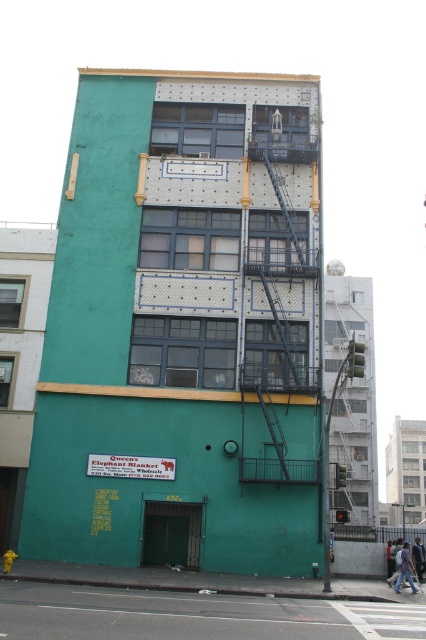
You are standing in front of the teal matte building at center and want to access the black metal fire escape at center. Can you reach the fire escape without going around the building?

The teal matte building at center is in front of the black metal fire escape at center, so you cannot reach the fire escape directly. You will need to go around the building to access it.

You are a window cleaner standing on the ground floor. You need to clean the windows of the teal matte building at center and the black metal fire escape at center. Which one will require you to climb higher?

The teal matte building at center is much taller than the black metal fire escape at center, so you will need to climb higher to clean the teal matte building at center.

You are standing in front of the teal matte building at center and want to reach the black metal fire escape at center. Which direction should you move to get to the fire escape from the building?

The teal matte building at center is positioned on the left side of the black metal fire escape at center, so you should move to the right to reach the fire escape from the building.